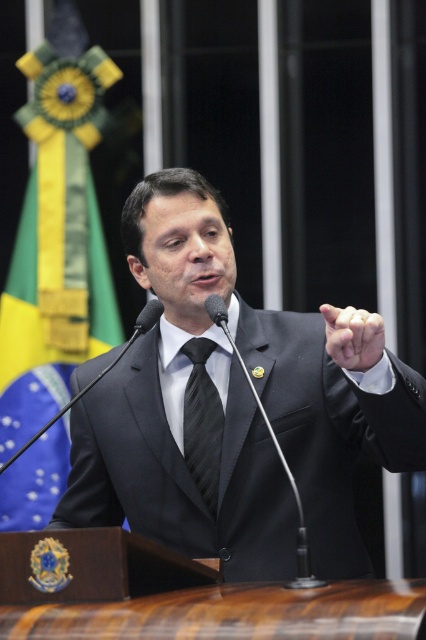
You are a sound technician adjusting the microphones for a presentation. You have two microphones on the podium. Which one is wider in width between the black matte microphone at center and the black plastic microphone at center?

The black matte microphone at center is wider than the black plastic microphone at center according to the description.

You are a speaker who needs to choose between the black metallic microphone at center and the black matte microphone at center. Which one is on the right side from your perspective?

The black metallic microphone at center is positioned on the right side of the black matte microphone at center, so the black metallic microphone at center is on the right side.

You are sitting in the audience and want to know which of the two points, point (259, 403) or point (152, 310), is closer to you. Which one is it?

Point (259, 403) is closer to the viewer than point (152, 310).